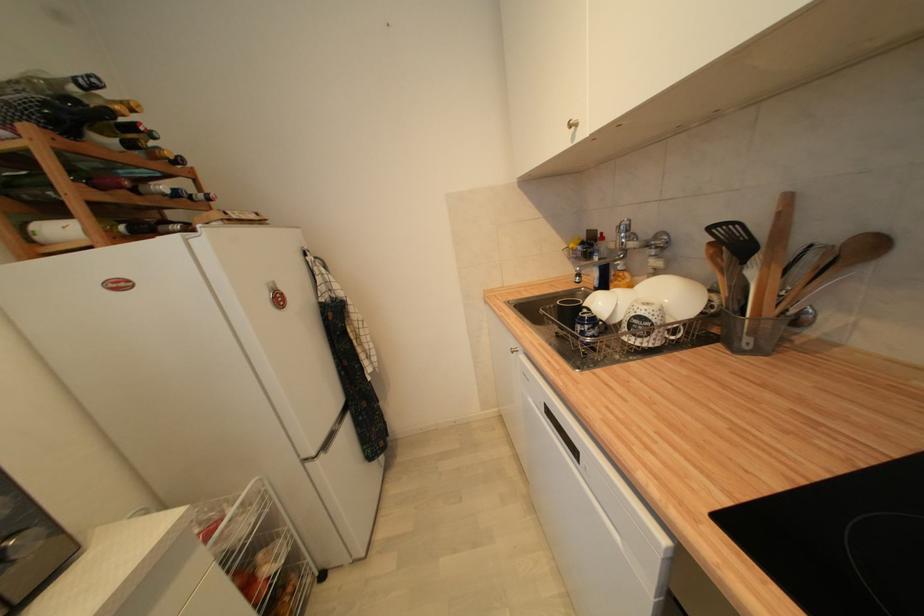
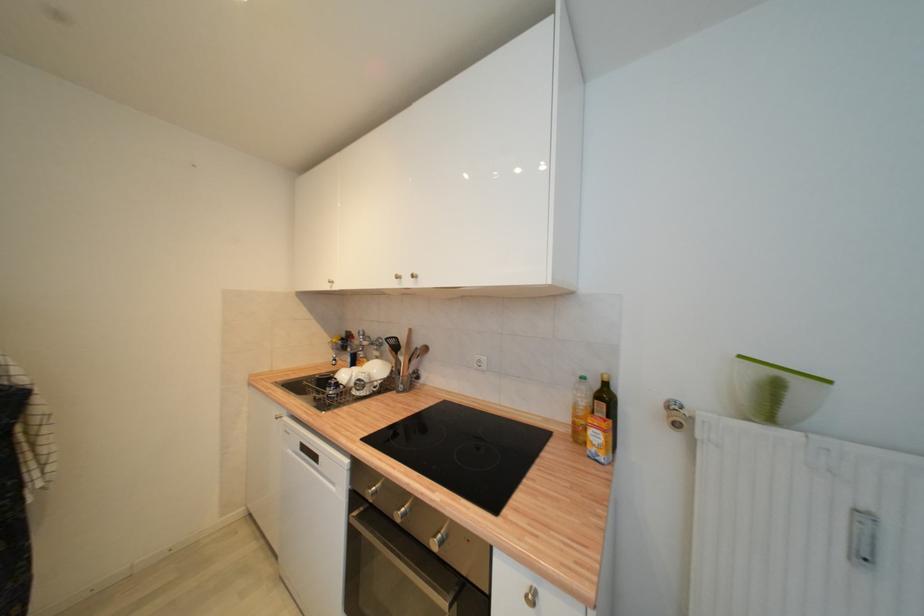
In the second image, find the point that corresponds to point 825,233 in the first image.

(422, 345)